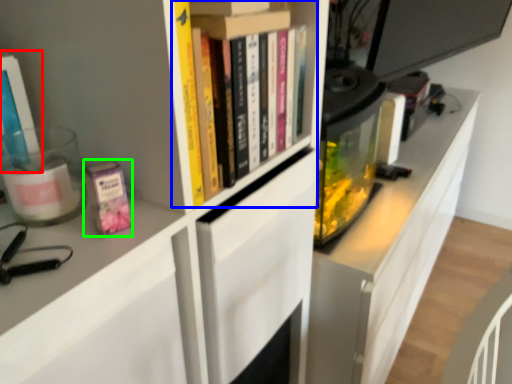
Question: Which is farther away from book (highlighted by a red box)? book (highlighted by a blue box) or paperback book (highlighted by a green box)?

Choices:
 (A) book
 (B) paperback book

Answer: (A)